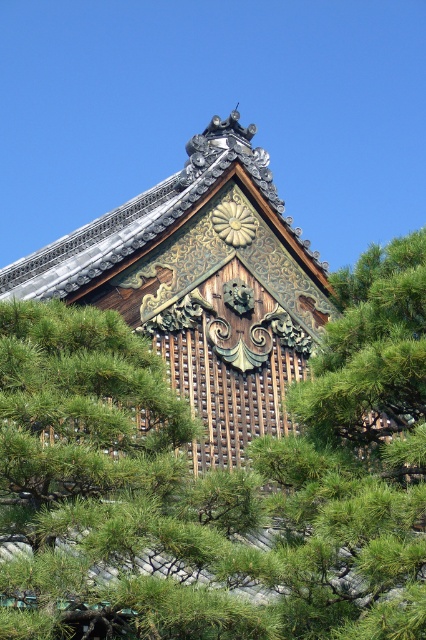
You are standing in front of the traditional Japanese building and want to take a photo of both the point at coordinates point (x=80, y=413) and point (x=91, y=275). Which point should you focus on first to ensure both are in focus?

You should focus on point (x=80, y=413) first because it is closer to the camera than point (x=91, y=275). This ensures the closer point is in focus, and the farther point will also be within the depth of field.

You are a drone operator tasked with capturing aerial footage of the temple. Your drone is currently positioned between the green textured pine tree at center and the central peak of the roof. The drone has a maximum flight range of 40 meters. Can the drone safely return to its starting position without exceeding its range?

The distance between the green textured pine tree at center and the central peak is 38.66 meters, so yes, the drone can safely return to its starting position without exceeding its 40 meter range.